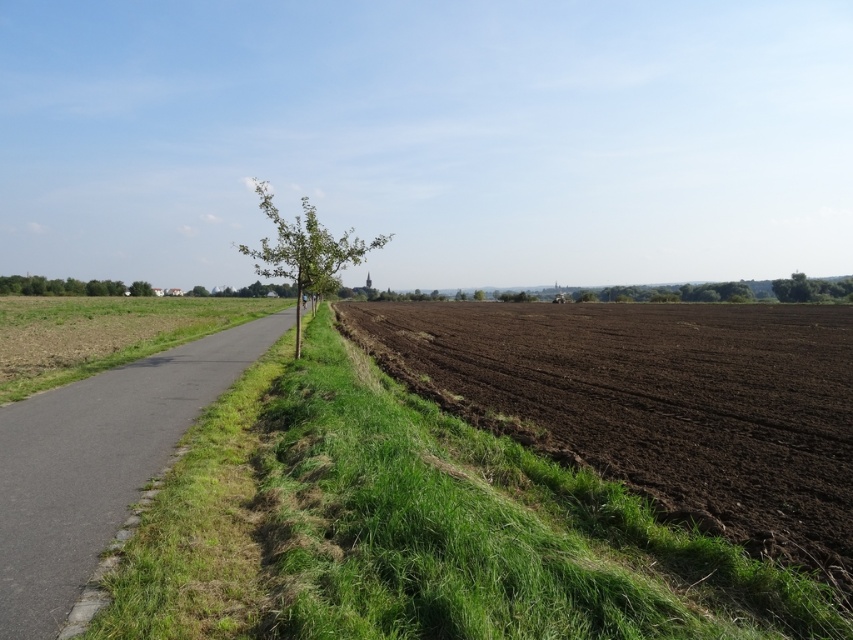
Which is behind, point (151, 288) or point (780, 280)?

Point (151, 288)

Image resolution: width=853 pixels, height=640 pixels. In order to click on green leafy tree at left in this screenshot , I will do `click(68, 285)`.

Between point (79, 512) and point (18, 278), which one is positioned in front?

Point (79, 512)

Who is more distant from viewer, (109, 449) or (138, 288)?

Point (138, 288)

Where is `asphalt road at center`? The height and width of the screenshot is (640, 853). asphalt road at center is located at coordinates (97, 464).

Describe the element at coordinates (416, 531) in the screenshot. This screenshot has width=853, height=640. I see `green grass at lower left` at that location.

Describe the element at coordinates (416, 531) in the screenshot. The height and width of the screenshot is (640, 853). I see `green grass at lower left` at that location.

Locate an element on the screen. The image size is (853, 640). green grass at lower left is located at coordinates (416, 531).